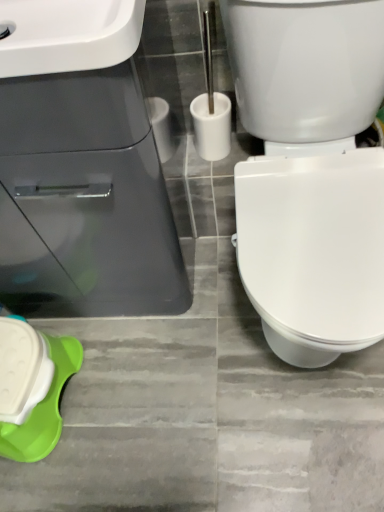
Question: Is white glossy sink at upper left, the second sink positioned from the back, taller or shorter than green plastic container at lower left?

Choices:
 (A) tall
 (B) short

Answer: (B)

Question: Looking at the image, does white glossy sink at upper left, the second sink positioned from the back, seem bigger or smaller compared to green plastic container at lower left?

Choices:
 (A) big
 (B) small

Answer: (A)

Question: Estimate the real-world distances between objects in this image. Which object is closer to the white glossy sink at upper left, the second sink positioned from the back?

Choices:
 (A) white glossy sink at upper left, which is counted as the 1th sink, starting from the back
 (B) green plastic container at lower left
 (C) white plastic toilet brush at center
 (D) white glossy bidet at right

Answer: (A)

Question: Estimate the real-world distances between objects in this image. Which object is closer to the white glossy sink at upper left, the second sink positioned from the back?

Choices:
 (A) white plastic toilet brush at center
 (B) green plastic container at lower left
 (C) white glossy sink at upper left, which is counted as the 1th sink, starting from the back
 (D) white glossy bidet at right

Answer: (C)